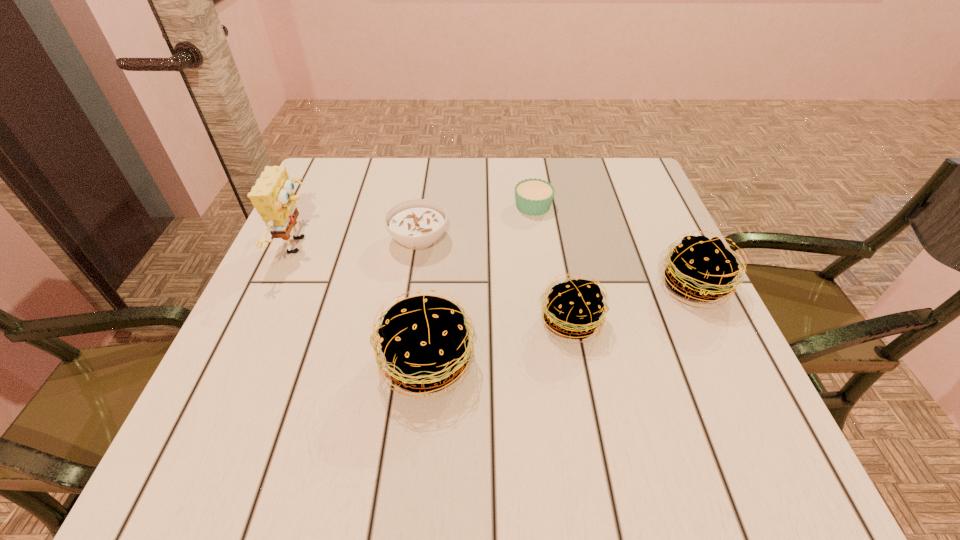
I want to click on the leftmost patty, so click(424, 340).

At what (x,y) coordinates should I click in order to perform the action: click on the second patty from right to left. Please return your answer as a coordinate pair (x, y). Looking at the image, I should click on (574, 307).

Locate an element on the screen. the shortest patty is located at coordinates (574, 307).

Where is `the third tallest object`? The height and width of the screenshot is (540, 960). the third tallest object is located at coordinates (701, 269).

Locate an element on the screen. Image resolution: width=960 pixels, height=540 pixels. the second shortest patty is located at coordinates (701, 269).

The height and width of the screenshot is (540, 960). I want to click on the shortest object, so click(534, 196).

Identify the location of soup bowl. Image resolution: width=960 pixels, height=540 pixels. (418, 223).

Identify the location of the tallest object. (273, 197).

The width and height of the screenshot is (960, 540). Identify the location of sponge. tap(273, 197).

This screenshot has width=960, height=540. In order to click on free region located 0.160m on the right of the leftmost patty in this screenshot , I will do (x=566, y=363).